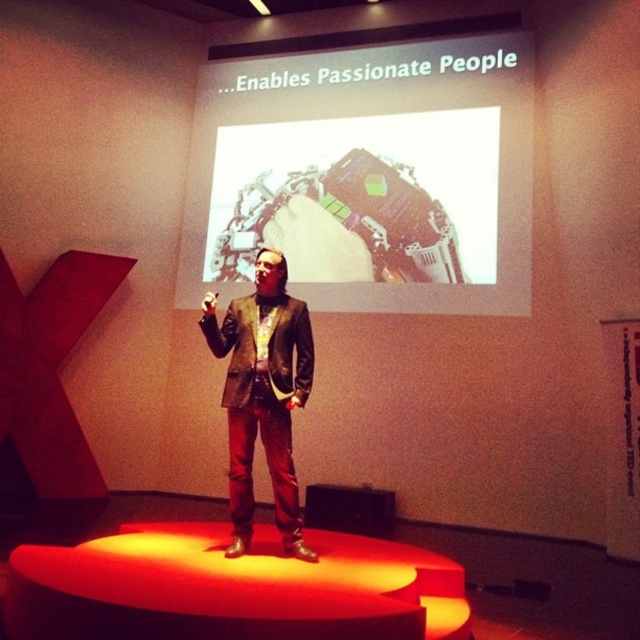
You are an event planner setting up a presentation. The projector is placed at point 0.277, 0.575. You need to ensure the white matte projection screen at upper center is correctly positioned. Where should the projector be aimed?

The projector should be aimed at the white matte projection screen at upper center located at point (368,177).

Looking at this image, you are an event planner setting up a presentation. You need to ensure that both the white matte projection screen at upper center and the brown leather jacket at center are visible to the audience. Given their sizes, which object should you position closer to the front to maintain visibility?

The brown leather jacket at center should be positioned closer to the front because the white matte projection screen at upper center is bigger and can be seen from a distance, while the smaller brown leather jacket at center needs to be closer to ensure visibility.

You are an event organizer checking the setup for a presentation. You notice the white matte projection screen at upper center and the brown leather jacket at center. Which object is positioned to the right side of the other?

The white matte projection screen at upper center is to the right of the brown leather jacket at center.